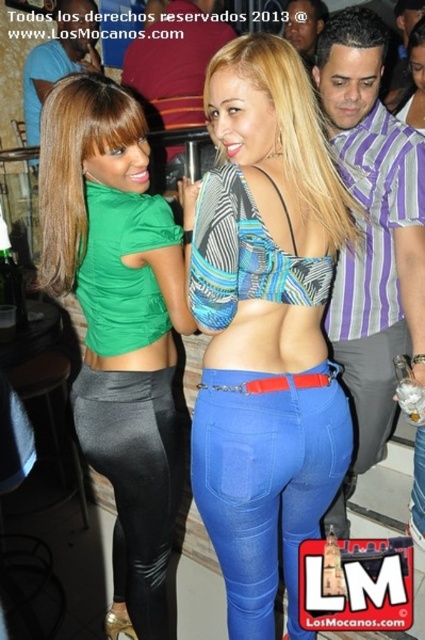
You are a photographer positioned at the back of the nightclub. You want to take a photo of the blue denim jeans at center and the black leather leggings at lower left. Which piece of clothing will appear larger in your photo?

The blue denim jeans at center will appear larger in the photo because it is closer to the viewer than the black leather leggings at lower left, making it appear bigger in the frame.

You are a fashion designer observing the scene at the nightclub. You need to decide which piece of clothing would require less fabric to produce between the blue denim jeans at center and the black leather leggings at lower left. Which one would it be?

The blue denim jeans at center has a smaller size compared to black leather leggings at lower left, so it would require less fabric to produce.

From the picture: You are a fashion designer observing the two leggings in the image. The green matte leggings at center and the black leather leggings at lower left. Which of these two leggings has a wider leg opening?

The green matte leggings at center might be wider than black leather leggings at lower left.